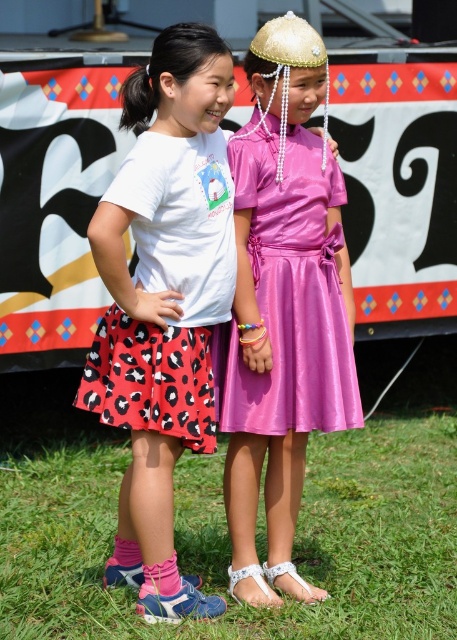
In the scene shown: Is green grass at lower center above red polka dot skirt at center?

Actually, green grass at lower center is below red polka dot skirt at center.

Is green grass at lower center taller than red polka dot skirt at center?

No.

Is point (111, 493) positioned after point (144, 326)?

Yes, it is.

Where is `green grass at lower center`? green grass at lower center is located at coordinates (293, 547).

Who is positioned more to the right, green grass at lower center or shiny pink dress at center?

green grass at lower center is more to the right.

Identify the location of green grass at lower center. (293, 547).

What are the coordinates of `green grass at lower center` in the screenshot? It's located at (293, 547).

Between red polka dot skirt at center and shiny pink dress at center, which one is positioned higher?

shiny pink dress at center is above.

Who is positioned more to the left, red polka dot skirt at center or shiny pink dress at center?

Positioned to the left is red polka dot skirt at center.

Which is behind, point (179, 324) or point (311, 296)?

The point (311, 296) is more distant.

Find the location of a particular element. red polka dot skirt at center is located at coordinates (168, 289).